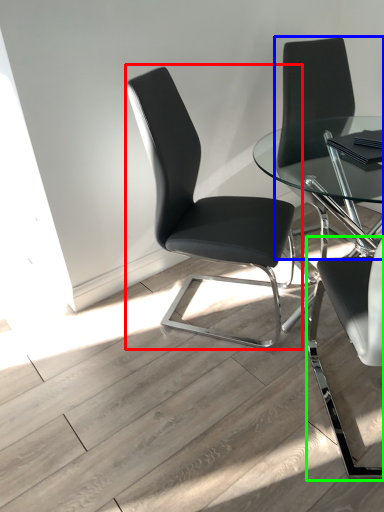
Question: Which object is the farthest from chair (highlighted by a red box)? Choose among these: chair (highlighted by a blue box) or chair (highlighted by a green box).

Choices:
 (A) chair
 (B) chair

Answer: (A)